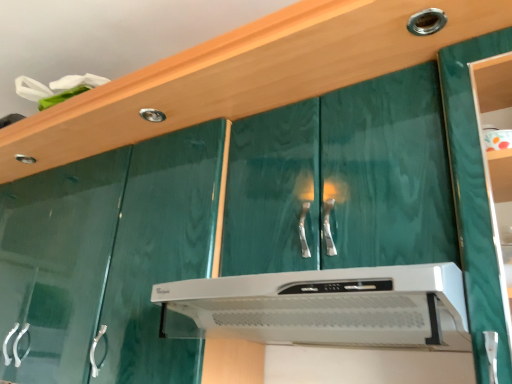
Question: Is white plastic range hood at center spatially inside metallic silver knob at upper right, or outside of it?

Choices:
 (A) inside
 (B) outside

Answer: (B)

Question: Is white plastic range hood at center taller or shorter than metallic silver knob at upper right?

Choices:
 (A) tall
 (B) short

Answer: (A)

Question: Looking at their shapes, would you say white plastic range hood at center is wider or thinner than metallic silver knob at upper right?

Choices:
 (A) thin
 (B) wide

Answer: (B)

Question: From the image's perspective, is metallic silver knob at upper right located above or below white plastic range hood at center?

Choices:
 (A) below
 (B) above

Answer: (B)

Question: From a real-world perspective, relative to white plastic range hood at center, is metallic silver knob at upper right vertically above or below?

Choices:
 (A) above
 (B) below

Answer: (A)

Question: Is metallic silver knob at upper right inside the boundaries of white plastic range hood at center, or outside?

Choices:
 (A) inside
 (B) outside

Answer: (B)

Question: In terms of height, does metallic silver knob at upper right look taller or shorter compared to white plastic range hood at center?

Choices:
 (A) tall
 (B) short

Answer: (B)